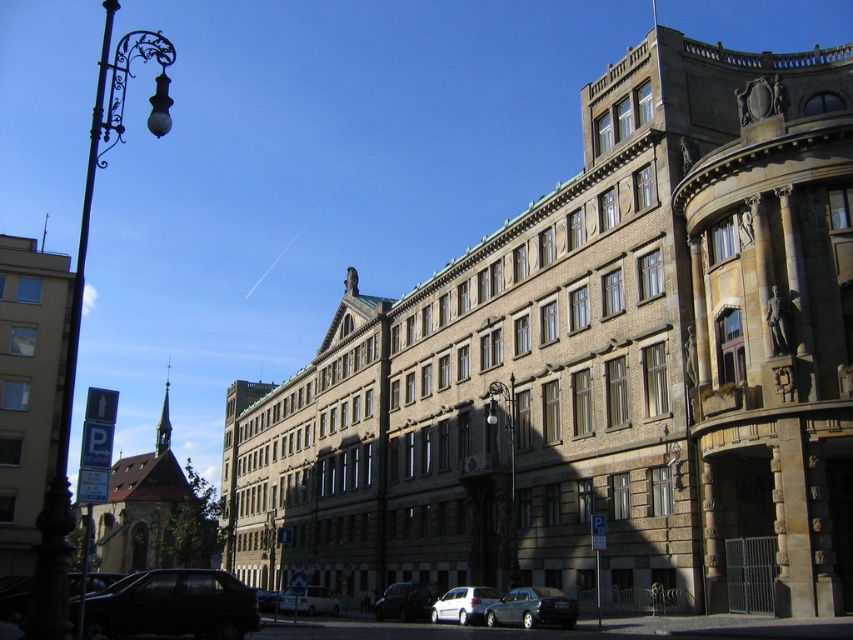
Between point (115, 100) and point (291, 611), which one is positioned behind?

Point (115, 100)

Is point (169, 61) positioned after point (329, 611)?

No.

The width and height of the screenshot is (853, 640). Identify the location of black wrought iron streetlight at left. (80, 305).

Is point (515, 538) in front of point (485, 596)?

No, it is not.

Is point (515, 544) farther from viewer compared to point (479, 621)?

Yes, point (515, 544) is behind point (479, 621).

I want to click on metallic streetlamp at center, so click(x=509, y=458).

Is matte black suv at lower left below white matte van at center?

No, matte black suv at lower left is not below white matte van at center.

Between matte black suv at lower left and white matte van at center, which one has more height?

With more height is white matte van at center.

Locate an element on the screen. This screenshot has height=640, width=853. matte black suv at lower left is located at coordinates (172, 605).